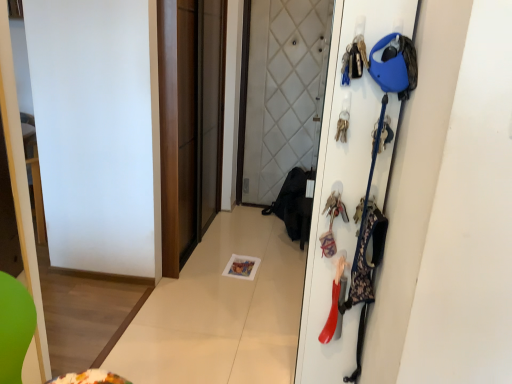
Question: Based on their sizes in the image, would you say brown matte sliding door at center is bigger or smaller than metallic keychain at upper right, marked as the 3th accessory in a bottom-to-top arrangement?

Choices:
 (A) big
 (B) small

Answer: (A)

Question: From a real-world perspective, is brown matte sliding door at center physically located above or below metallic keychain at upper right, arranged as the 1th accessory when viewed from the top?

Choices:
 (A) above
 (B) below

Answer: (B)

Question: Which is nearer to the white matte door at right?

Choices:
 (A) metallic keychain at upper right, arranged as the 1th accessory when viewed from the top
 (B) rubberized plastic shoe at right, the 3th accessory from the top
 (C) floral fabric bag at right, which is the 2th accessory from top to bottom
 (D) brown matte sliding door at center

Answer: (C)

Question: Which object is the farthest from the brown matte sliding door at center?

Choices:
 (A) white matte door at right
 (B) metallic keychain at upper right, arranged as the 1th accessory when viewed from the top
 (C) floral fabric bag at right, the 2th accessory when ordered from bottom to top
 (D) rubberized plastic shoe at right, the 1th accessory from the bottom

Answer: (B)